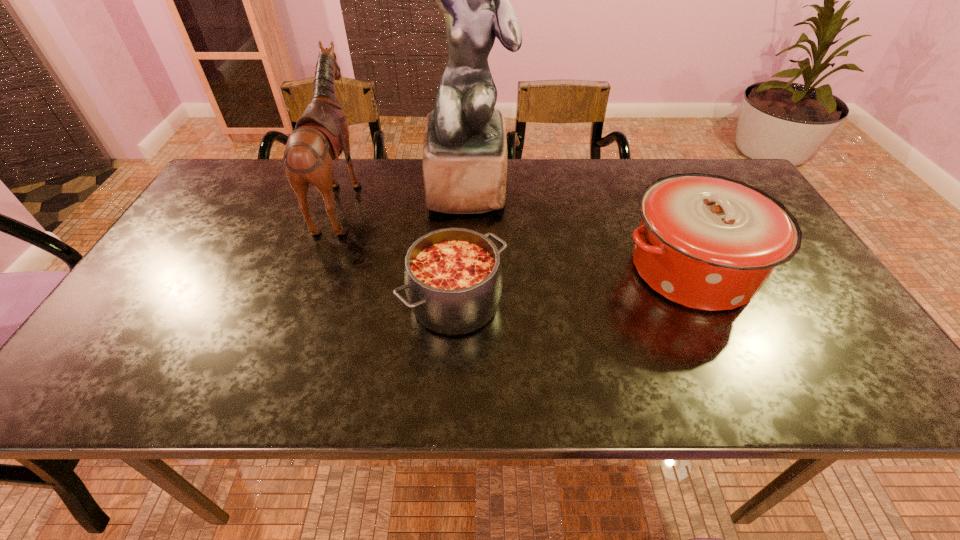
Find the location of a particular element. The height and width of the screenshot is (540, 960). vacant space that satisfies the following two spatial constraints: 1. on the back of the saddle; 2. on the right side of the shortest object is located at coordinates (303, 303).

You are a GUI agent. You are given a task and a screenshot of the screen. Output one action in this format:
    pyautogui.click(x=<x>, y=<y>)
    Task: Click on the free region that satisfies the following two spatial constraints: 1. in a relaxed pose on the right casserole; 2. on the left side of the sculpture
    This screenshot has height=540, width=960.
    Given the screenshot: What is the action you would take?
    pyautogui.click(x=467, y=269)

Locate an element on the screen. blank area in the image that satisfies the following two spatial constraints: 1. on the back of the shorter casserole; 2. on the left side of the saddle is located at coordinates (303, 303).

I want to click on free space that satisfies the following two spatial constraints: 1. in a relaxed pose on the right casserole; 2. on the left side of the sculpture, so click(x=467, y=269).

Where is `vacant space that satisfies the following two spatial constraints: 1. in a relaxed pose on the sculpture; 2. on the right side of the rightmost object`? Image resolution: width=960 pixels, height=540 pixels. vacant space that satisfies the following two spatial constraints: 1. in a relaxed pose on the sculpture; 2. on the right side of the rightmost object is located at coordinates (467, 269).